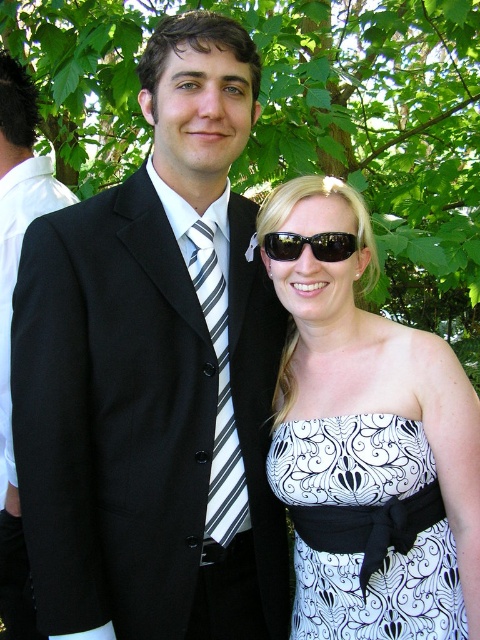
You are a photographer trying to capture a closeup of the white printed dress at center without including the green leafy tree at upper center in the frame. Based on their sizes, can you suggest whether zooming in or moving closer would be more effective?

The green leafy tree at upper center is wider than the white printed dress at center. To avoid including the tree in the frame, moving closer to the white printed dress at center would be more effective than zooming in, as the tree is larger and might still appear in the background if zoomed in while at a distance.

You are a photographer trying to capture a clear shot of the white printed dress at center and the green leafy tree at upper center. Which object is closer to the camera?

The green leafy tree at upper center is closer to the camera because the white printed dress at center is positioned behind it.